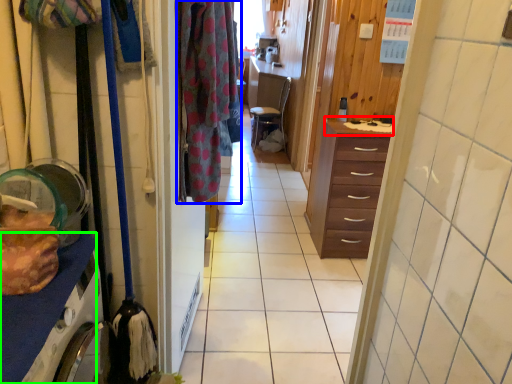
Question: Which object is positioned closest to counter top (highlighted by a red box)? Select from clothing (highlighted by a blue box) and cabinetry (highlighted by a green box).

Choices:
 (A) clothing
 (B) cabinetry

Answer: (A)